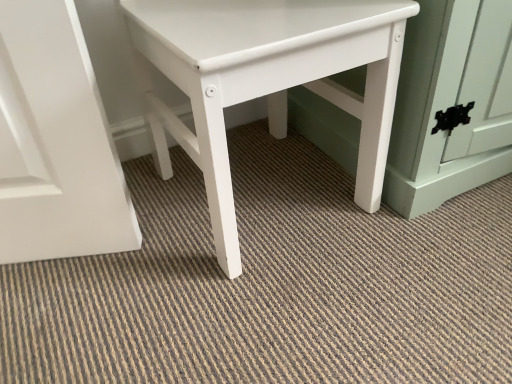
The image size is (512, 384). What do you see at coordinates (267, 80) in the screenshot?
I see `white matte table at center` at bounding box center [267, 80].

The width and height of the screenshot is (512, 384). I want to click on white matte table at center, so click(267, 80).

Where is `white matte table at center`? white matte table at center is located at coordinates point(267,80).